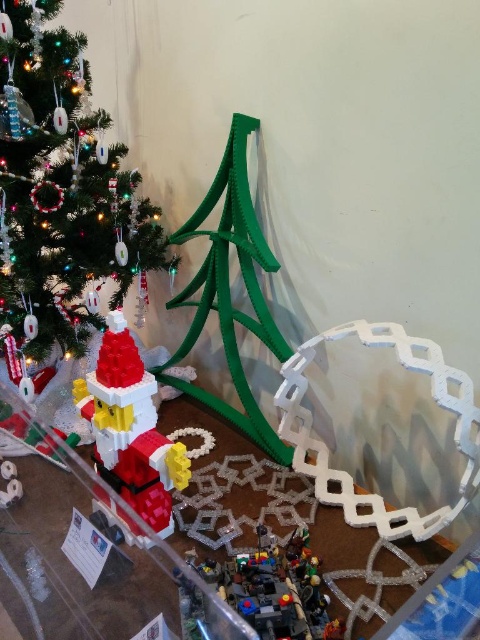
Is matte plastic santa at center positioned at the back of translucent plastic minifigures at lower center?

That is False.

Does matte plastic santa at center have a larger size compared to translucent plastic minifigures at lower center?

Yes, matte plastic santa at center is bigger than translucent plastic minifigures at lower center.

You are a GUI agent. You are given a task and a screenshot of the screen. Output one action in this format:
    pyautogui.click(x=<x>, y=<y>)
    Task: Click on the matte plastic santa at center
    The image size is (480, 640).
    Given the screenshot: What is the action you would take?
    pyautogui.click(x=131, y=428)

Locate an element on the screen. This screenshot has width=480, height=640. matte plastic santa at center is located at coordinates [131, 428].

Can you confirm if green matte christmas tree at left is smaller than translucent plastic minifigures at lower center?

No.

Is the position of green matte christmas tree at left less distant than that of translucent plastic minifigures at lower center?

No.

Measure the distance between point (63,36) and camera.

Point (63,36) and camera are 3.49 feet apart.

Identify the location of green matte christmas tree at left. (61, 186).

Between point (59, 192) and point (128, 388), which one is positioned behind?

The point (59, 192) is more distant.

The height and width of the screenshot is (640, 480). I want to click on green matte christmas tree at left, so click(61, 186).

Find the location of `green matte christmas tree at left`. green matte christmas tree at left is located at coordinates (61, 186).